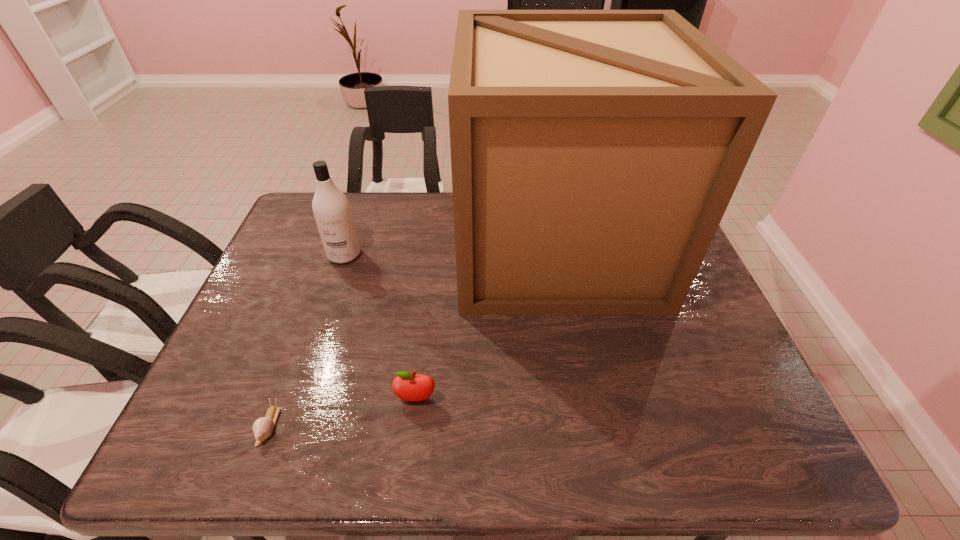
This screenshot has height=540, width=960. What are the coordinates of `the rightmost object` in the screenshot? It's located at (594, 153).

Find the location of a particular element. This screenshot has width=960, height=540. box is located at coordinates (594, 153).

Find the location of a particular element. Image resolution: width=960 pixels, height=540 pixels. the third shortest object is located at coordinates (331, 208).

Find the location of `the third tallest object`. the third tallest object is located at coordinates [x=409, y=387].

Where is `the second object from right to left`? The height and width of the screenshot is (540, 960). the second object from right to left is located at coordinates (409, 387).

What are the coordinates of `the shortest object` in the screenshot? It's located at coord(262,427).

Where is `vacant area situated on the reinforced sides of the tallest object`? This screenshot has height=540, width=960. vacant area situated on the reinforced sides of the tallest object is located at coordinates (429, 244).

This screenshot has height=540, width=960. In order to click on vacant area situated on the reinforced sides of the tallest object in this screenshot , I will do `click(409, 244)`.

Where is `blank area located 0.240m on the reinforced sides of the tallest object`? The width and height of the screenshot is (960, 540). blank area located 0.240m on the reinforced sides of the tallest object is located at coordinates (383, 244).

Identify the location of blank space located on the front-facing side of the shampoo. The height and width of the screenshot is (540, 960). (326, 307).